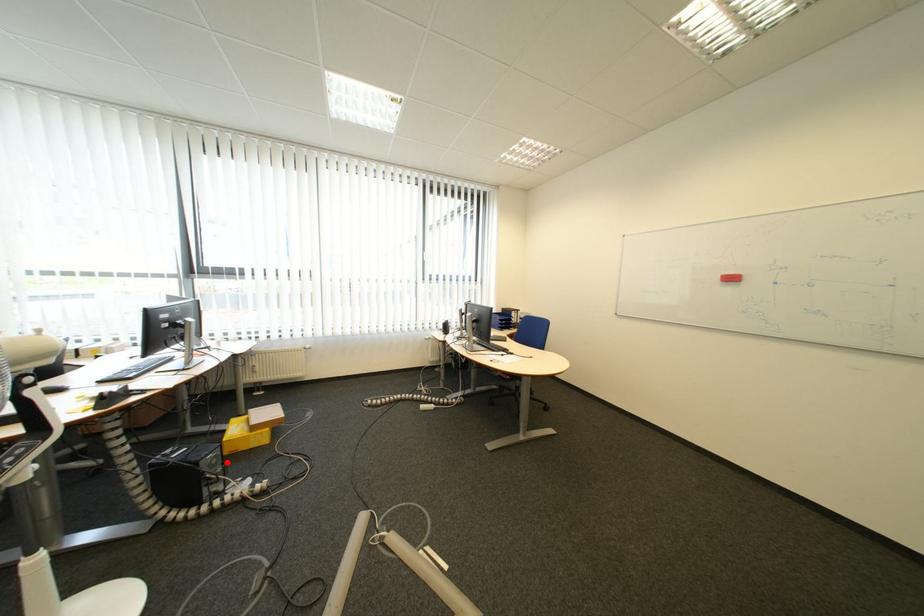
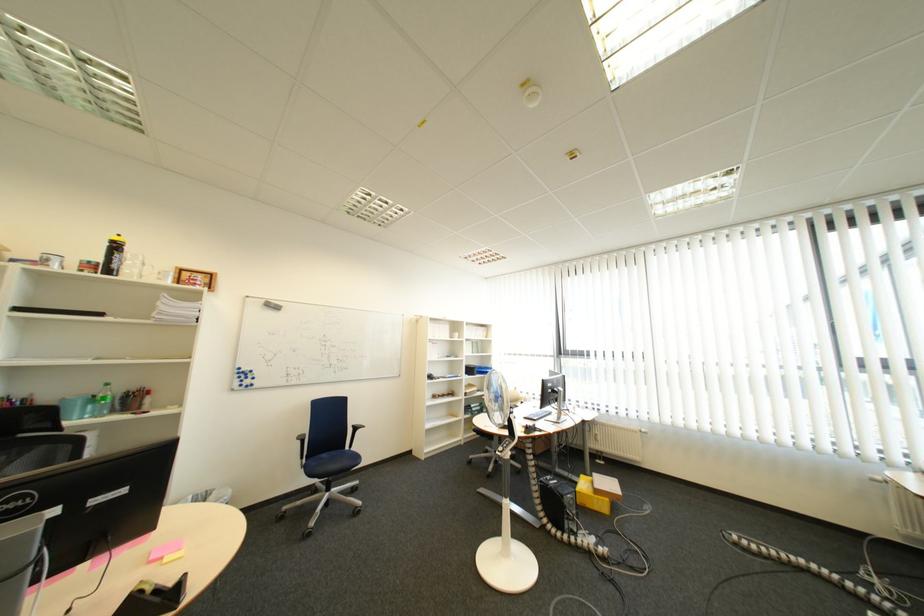
Question: I am providing you with two images of the same scene from different viewpoints. Given a red point in image1, look at the same physical point in image2. Is it:

Choices:
 (A) Closer to the viewpoint
 (B) Farther from the viewpoint

Answer: (B)